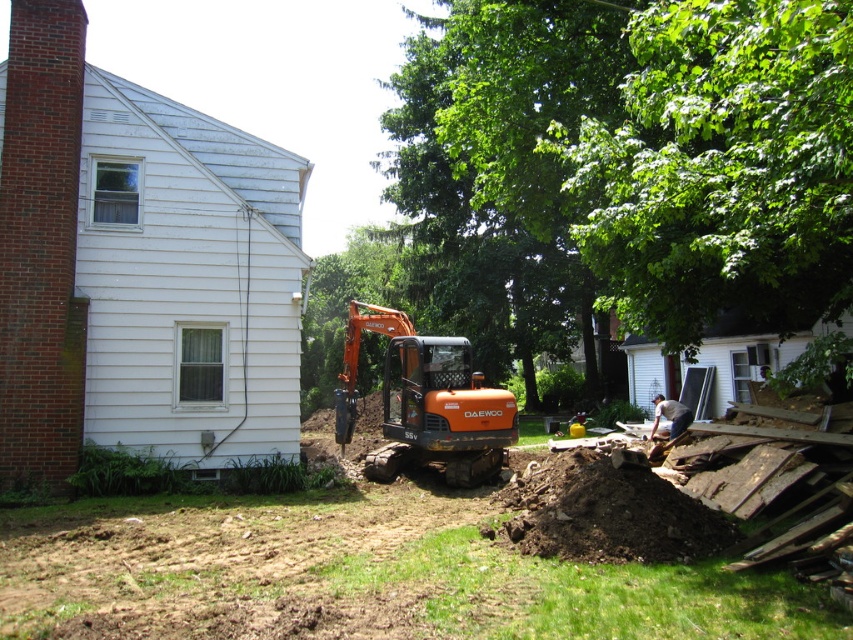
You are standing in the backyard and want to place a 20 feet long fence post from the point where you are standing to the point at coordinates point (200,618). Is the distance sufficient?

The distance to point (200,618) is 19.00 feet, which is shorter than the 20 feet required for the fence post. Therefore, the distance is insufficient.

You are standing at the point marked as point (355, 573) in the backyard. What object is exactly at that point?

The orange metallic excavator at center is located at point (355, 573).